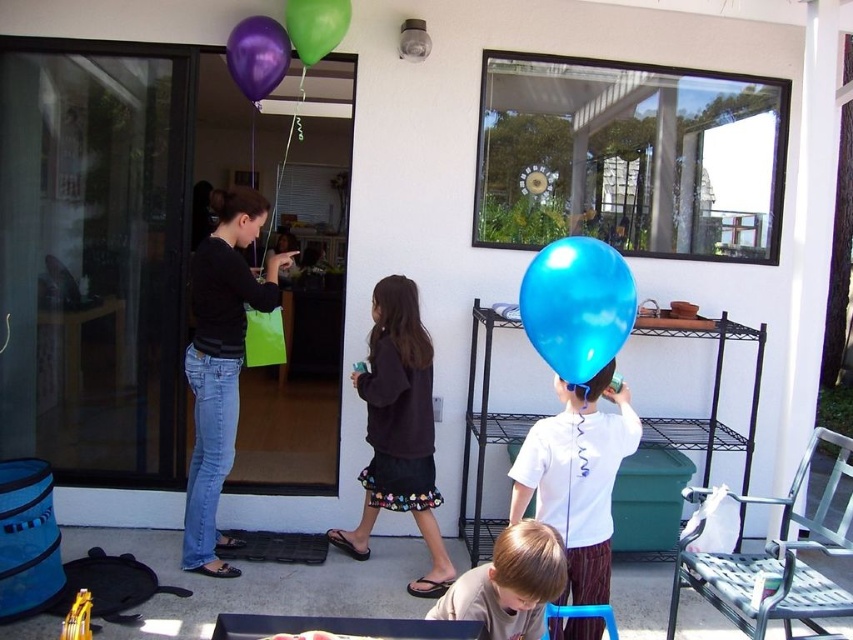
Consider the image. Who is lower down, white matte shirt at center or blue rubber balloon at center?

Positioned lower is white matte shirt at center.

Who is more forward, [622,396] or [587,312]?

Positioned in front is point [587,312].

In order to click on white matte shirt at center in this screenshot , I will do click(577, 477).

Which is above, white matte shirt at center or brown cotton shirt at lower center?

white matte shirt at center

Which of these two, white matte shirt at center or brown cotton shirt at lower center, stands taller?

white matte shirt at center is taller.

Who is more distant from viewer, (608, 378) or (506, 561)?

The point (608, 378) is behind.

What are the coordinates of `white matte shirt at center` in the screenshot? It's located at (577, 477).

Which of these two, white matte shirt at center or metallic purple balloon at upper center, stands shorter?

Standing shorter between the two is metallic purple balloon at upper center.

Does white matte shirt at center have a greater height compared to metallic purple balloon at upper center?

Yes, white matte shirt at center is taller than metallic purple balloon at upper center.

Find the location of `white matte shirt at center`. white matte shirt at center is located at coordinates (577, 477).